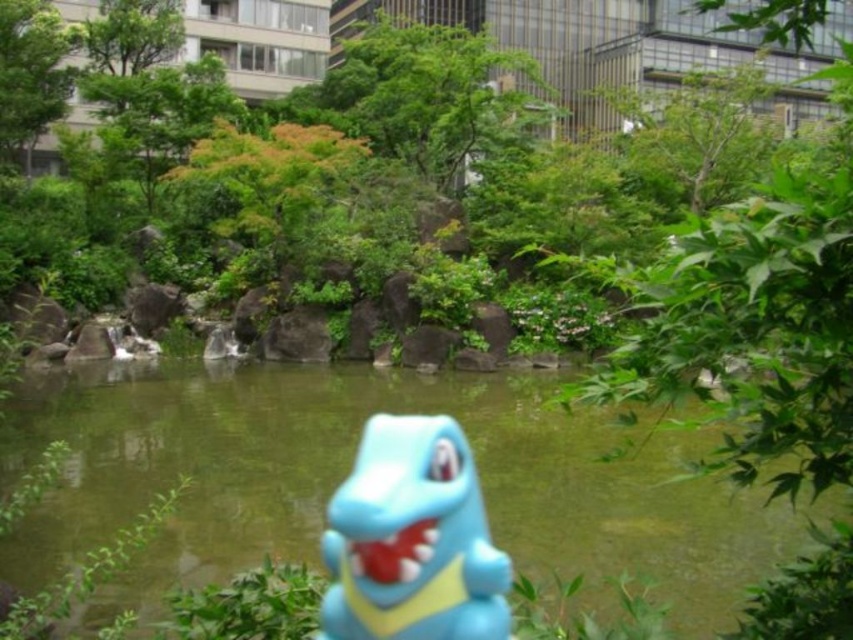
Find the location of a particular element. This screenshot has width=853, height=640. green translucent water at center is located at coordinates (349, 468).

Is the position of green translucent water at center more distant than that of blue rubber dinosaur at center?

Yes, green translucent water at center is further from the viewer.

The width and height of the screenshot is (853, 640). Describe the element at coordinates (349, 468) in the screenshot. I see `green translucent water at center` at that location.

Locate an element on the screen. The height and width of the screenshot is (640, 853). green translucent water at center is located at coordinates (349, 468).